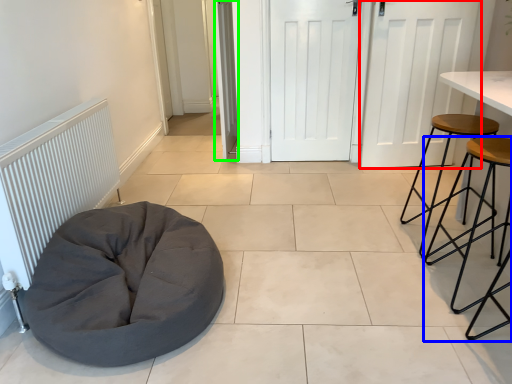
Question: Estimate the real-world distances between objects in this image. Which object is closer to door (highlighted by a red box), stool (highlighted by a blue box) or door (highlighted by a green box)?

Choices:
 (A) stool
 (B) door

Answer: (A)